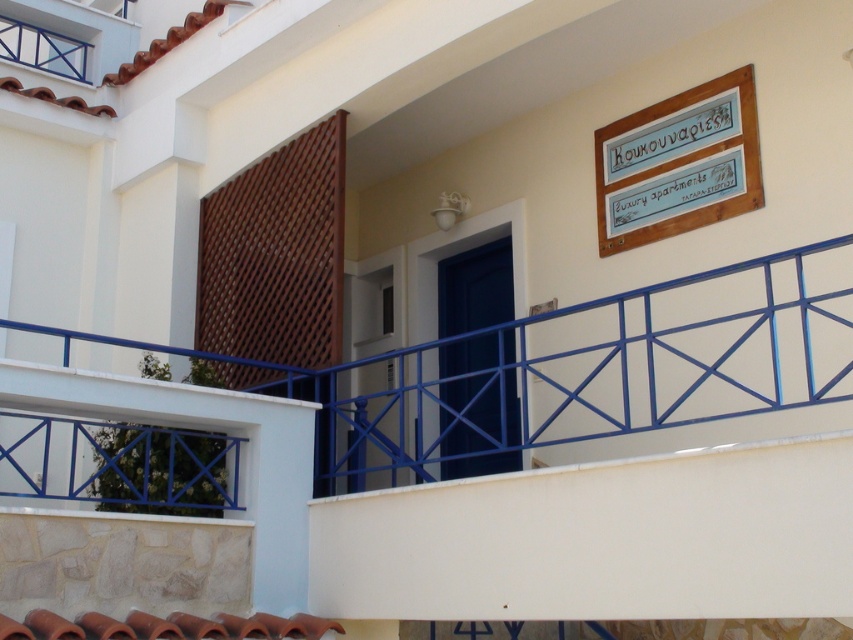
You are a painter who needs to paint both the white painted metal railing at lower center and the wooden signboard at upper right. You have a ladder that is 1.6 meters long. Can you safely reach both objects with your ladder?

The distance between the white painted metal railing at lower center and the wooden signboard at upper right is 1.58 meters. Since the ladder is 1.6 meters long, it is slightly longer than the distance, so you can safely reach both objects with your ladder.

You are standing in front of the building and notice a specific point marked at coordinates (567, 372). Based on the scene description, what object does this point indicate?

The point at coordinates (567, 372) indicates the white painted metal railing at lower center.

You are standing at the base of the building and want to read the wooden signboard at upper right. Considering the distance, can you easily read the text on it without moving closer?

The wooden signboard at upper right is 7.77 meters away from the camera. At this distance, it might be difficult to read the text clearly without moving closer.